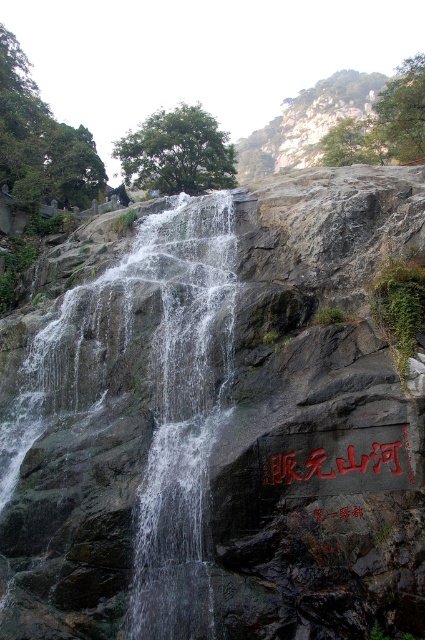
Question: Estimate the real-world distances between objects in this image. Which object is farther from the clear water at center?

Choices:
 (A) black stone sign at center
 (B) black stone writing at center

Answer: (A)

Question: Does clear water at center appear under black stone writing at center?

Choices:
 (A) yes
 (B) no

Answer: (B)

Question: Which object appears farthest from the camera in this image?

Choices:
 (A) clear water at center
 (B) black stone sign at center
 (C) black stone writing at center

Answer: (B)

Question: Does clear water at center have a greater width compared to black stone writing at center?

Choices:
 (A) yes
 (B) no

Answer: (A)

Question: Among these objects, which one is nearest to the camera?

Choices:
 (A) black stone sign at center
 (B) black stone writing at center

Answer: (B)

Question: Does clear water at center have a smaller size compared to black stone sign at center?

Choices:
 (A) yes
 (B) no

Answer: (B)